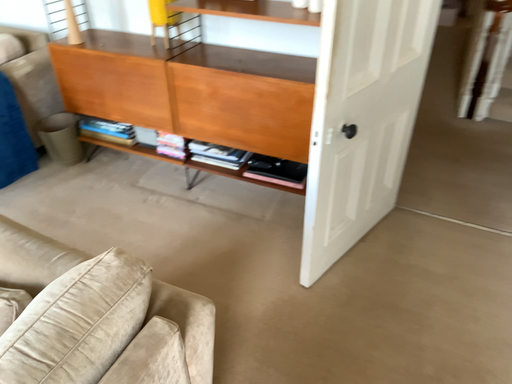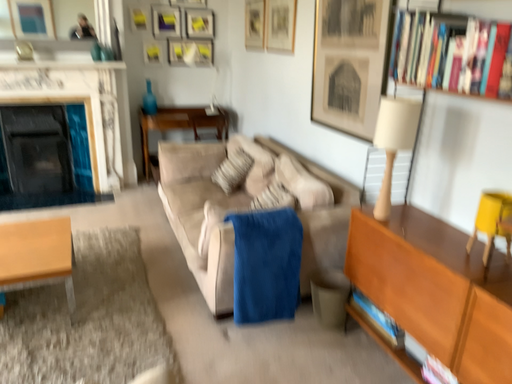
Question: Which way did the camera rotate in the video?

Choices:
 (A) rotated right
 (B) rotated left

Answer: (B)